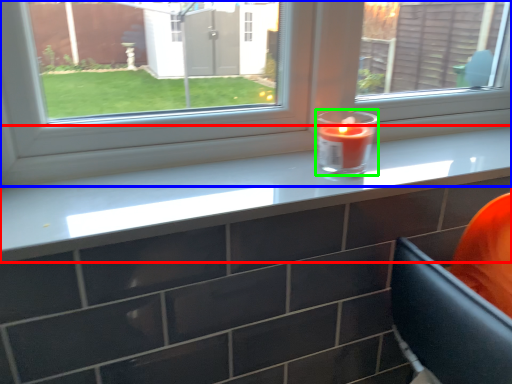
Question: Considering the real-world distances, which object is closest to counter top (highlighted by a red box)? window (highlighted by a blue box) or birthday candle (highlighted by a green box).

Choices:
 (A) window
 (B) birthday candle

Answer: (A)